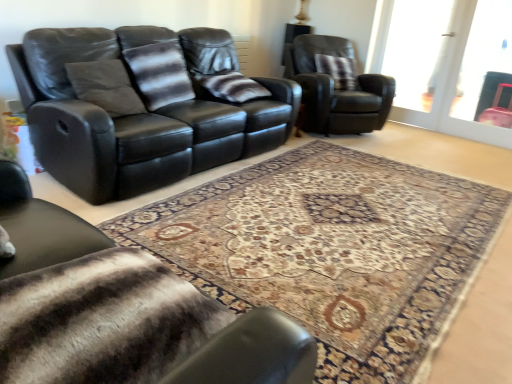
Question: Considering their positions, is transparent glass door at upper right located in front of or behind black leather couch at upper left?

Choices:
 (A) front
 (B) behind

Answer: (B)

Question: Does point (468, 59) appear closer or farther from the camera than point (59, 41)?

Choices:
 (A) farther
 (B) closer

Answer: (A)

Question: Which object is the closest to the striped fur blanket at lower left, positioned as the 2th chair in right-to-left order?

Choices:
 (A) plush brown pillow at upper right, the 1th pillow viewed from the right
 (B) transparent glass door at upper right
 (C) transparent glass screen door at upper right
 (D) striped fabric pillow at center, arranged as the 2th pillow when viewed from the left
 (E) black leather couch at upper left

Answer: (E)

Question: Which object is the closest to the black leather couch at upper left?

Choices:
 (A) striped fur blanket at lower left, the 1th chair from the front
 (B) transparent glass screen door at upper right
 (C) striped fabric pillow at center, the second pillow viewed from the back
 (D) striped fabric pillow at center, acting as the 1th pillow starting from the left
 (E) transparent glass door at upper right

Answer: (D)